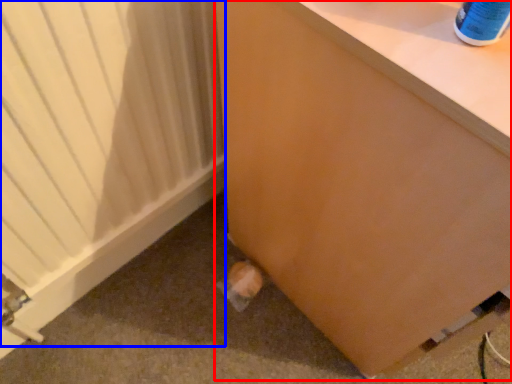
Question: Which object is further to the camera taking this photo, furniture (highlighted by a red box) or heater (highlighted by a blue box)?

Choices:
 (A) furniture
 (B) heater

Answer: (B)